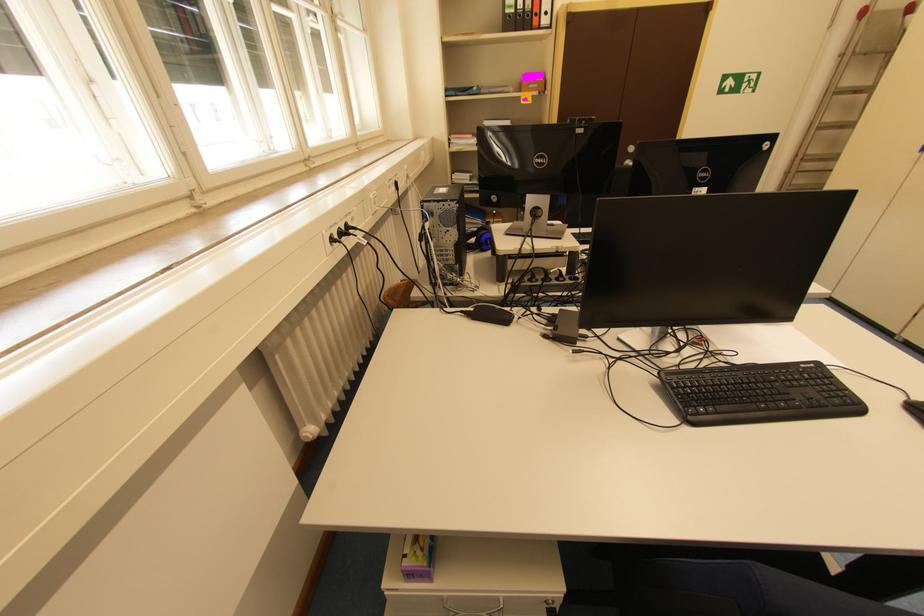
The image size is (924, 616). What are the coordinates of `chair armrest` in the screenshot? It's located at (584, 573).